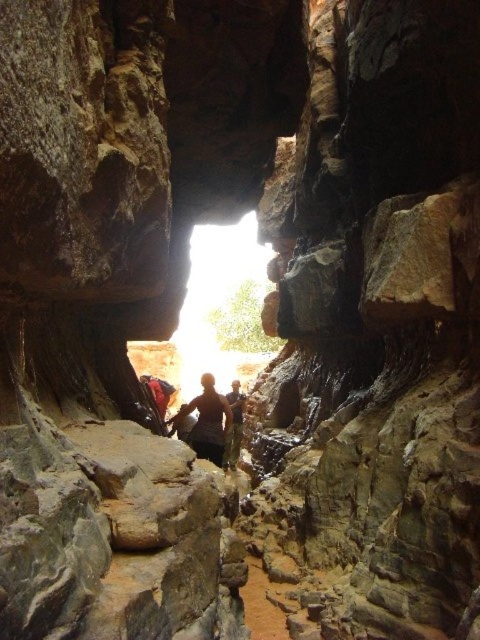
Does dark brown leather jacket at center have a larger size compared to camouflage pants at center?

Actually, dark brown leather jacket at center might be smaller than camouflage pants at center.

This screenshot has width=480, height=640. What do you see at coordinates (206, 420) in the screenshot?
I see `dark brown leather jacket at center` at bounding box center [206, 420].

Find the location of `dark brown leather jacket at center`. dark brown leather jacket at center is located at coordinates (206, 420).